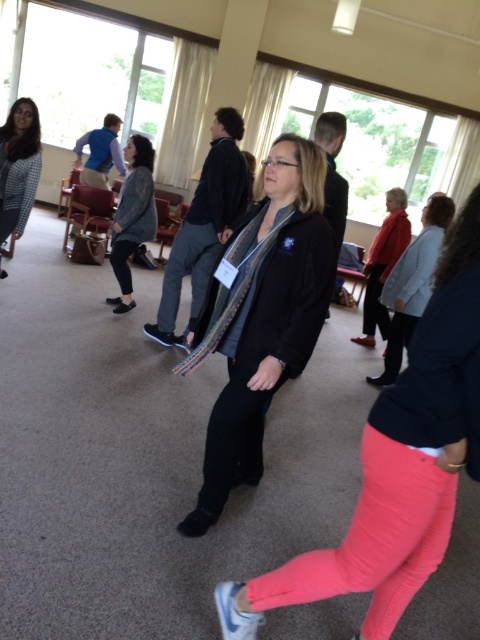
You are standing in the room and want to reach the point marked as point (456, 456). If your maximum reach distance is 1.2 meters, can you touch it without moving your feet?

The point (456, 456) is 1.25 meters away from you, which exceeds your maximum reach of 1.2 meters. Therefore, you cannot touch it without moving your feet.

You are organizing a clothing display and need to place the black matte jacket at center and the red matte jacket at upper right side by side. Which jacket requires more horizontal space to display properly?

The black matte jacket at center requires more horizontal space because its width is larger than the red matte jacket at upper right.